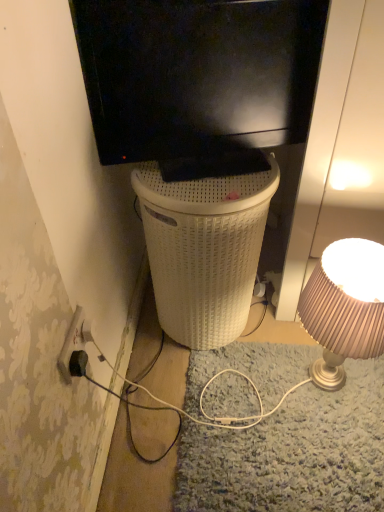
Question: Can you confirm if matte beige lampshade at right is taller than black plastic power outlet at lower left?

Choices:
 (A) no
 (B) yes

Answer: (B)

Question: From the image's perspective, does matte beige lampshade at right appear lower than black plastic power outlet at lower left?

Choices:
 (A) yes
 (B) no

Answer: (B)

Question: Does matte beige lampshade at right lie in front of black plastic power outlet at lower left?

Choices:
 (A) yes
 (B) no

Answer: (B)

Question: Is matte beige lampshade at right positioned far away from black plastic power outlet at lower left?

Choices:
 (A) yes
 (B) no

Answer: (B)

Question: Can you confirm if matte beige lampshade at right is shorter than black plastic power outlet at lower left?

Choices:
 (A) no
 (B) yes

Answer: (A)

Question: Is white woven basket at center taller or shorter than black matte television at upper center?

Choices:
 (A) tall
 (B) short

Answer: (A)

Question: Relative to black matte television at upper center, is white woven basket at center in front or behind?

Choices:
 (A) front
 (B) behind

Answer: (B)

Question: In the image, is white woven basket at center on the left side or the right side of black matte television at upper center?

Choices:
 (A) right
 (B) left

Answer: (B)

Question: In terms of width, does white woven basket at center look wider or thinner when compared to black matte television at upper center?

Choices:
 (A) wide
 (B) thin

Answer: (A)

Question: From a real-world perspective, is black matte television at upper center physically located above or below black plastic power outlet at lower left?

Choices:
 (A) above
 (B) below

Answer: (A)

Question: From their relative heights in the image, would you say black matte television at upper center is taller or shorter than black plastic power outlet at lower left?

Choices:
 (A) tall
 (B) short

Answer: (A)

Question: Is black matte television at upper center inside the boundaries of black plastic power outlet at lower left, or outside?

Choices:
 (A) inside
 (B) outside

Answer: (B)

Question: In terms of size, does black matte television at upper center appear bigger or smaller than black plastic power outlet at lower left?

Choices:
 (A) big
 (B) small

Answer: (A)

Question: Is black plastic power outlet at lower left inside the boundaries of white woven basket at center, or outside?

Choices:
 (A) inside
 (B) outside

Answer: (B)

Question: Is black plastic power outlet at lower left in front of or behind white woven basket at center in the image?

Choices:
 (A) behind
 (B) front

Answer: (B)